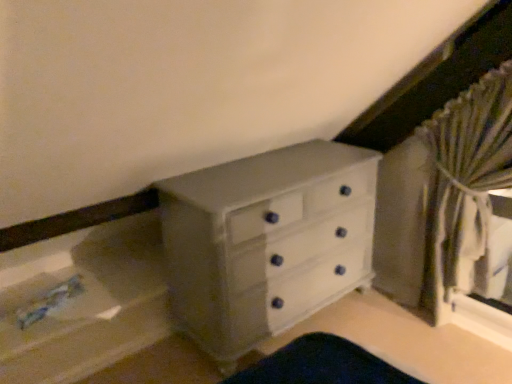
Where is `empty space that is ontop of white painted wood chest of drawers at center (from a real-world perspective)`? Image resolution: width=512 pixels, height=384 pixels. empty space that is ontop of white painted wood chest of drawers at center (from a real-world perspective) is located at coordinates (273, 171).